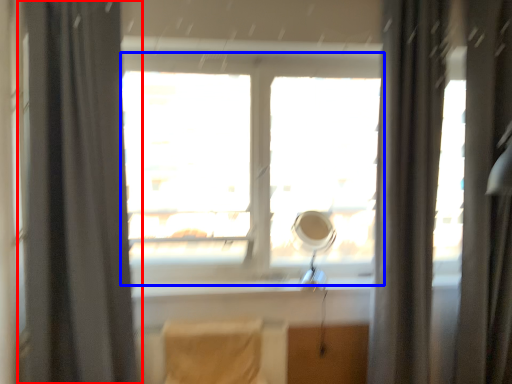
Question: Which of the following is the farthest to the observer, curtain (highlighted by a red box) or window (highlighted by a blue box)?

Choices:
 (A) curtain
 (B) window

Answer: (B)